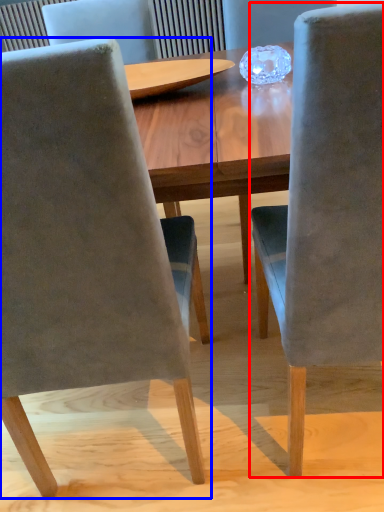
Question: Which point is further to the camera, chair (highlighted by a red box) or chair (highlighted by a blue box)?

Choices:
 (A) chair
 (B) chair

Answer: (B)